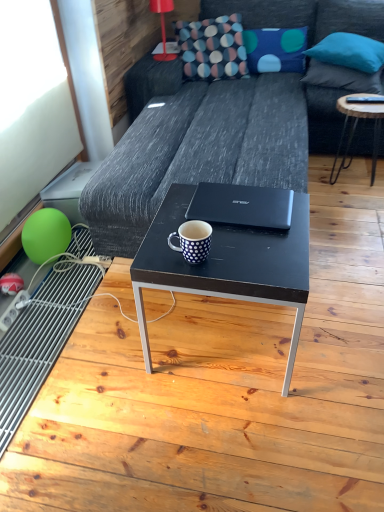
Locate an element on the screen. unoccupied space behind white dotted mug at center is located at coordinates (178, 224).